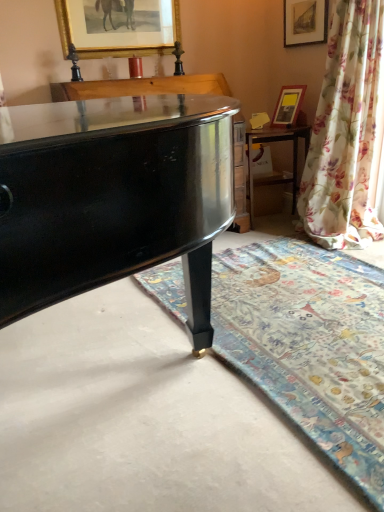
Question: From a real-world perspective, is carpet with floral pattern at lower right below wooden table at right?

Choices:
 (A) yes
 (B) no

Answer: (A)

Question: Would you say carpet with floral pattern at lower right contains wooden table at right?

Choices:
 (A) yes
 (B) no

Answer: (B)

Question: Does carpet with floral pattern at lower right have a larger size compared to wooden table at right?

Choices:
 (A) yes
 (B) no

Answer: (B)

Question: Is carpet with floral pattern at lower right looking in the opposite direction of wooden table at right?

Choices:
 (A) no
 (B) yes

Answer: (A)

Question: Are carpet with floral pattern at lower right and wooden table at right beside each other?

Choices:
 (A) no
 (B) yes

Answer: (A)

Question: Is carpet with floral pattern at lower right positioned far away from wooden table at right?

Choices:
 (A) no
 (B) yes

Answer: (B)

Question: Is carpet with floral pattern at lower right positioned beyond the bounds of gold-framed picture at upper center, which is the first picture frame in left-to-right order?

Choices:
 (A) yes
 (B) no

Answer: (A)

Question: From a real-world perspective, is carpet with floral pattern at lower right positioned over gold-framed picture at upper center, which is the first picture frame in left-to-right order, based on gravity?

Choices:
 (A) no
 (B) yes

Answer: (A)

Question: Is carpet with floral pattern at lower right taller than gold-framed picture at upper center, which appears as the third picture frame when viewed from the right?

Choices:
 (A) no
 (B) yes

Answer: (A)

Question: Is carpet with floral pattern at lower right next to gold-framed picture at upper center, which appears as the third picture frame when viewed from the right?

Choices:
 (A) no
 (B) yes

Answer: (A)

Question: From the image's perspective, does carpet with floral pattern at lower right appear higher than gold-framed picture at upper center, which appears as the third picture frame when viewed from the right?

Choices:
 (A) yes
 (B) no

Answer: (B)

Question: From the image's perspective, would you say carpet with floral pattern at lower right is shown under gold-framed picture at upper center, which is the first picture frame in left-to-right order?

Choices:
 (A) no
 (B) yes

Answer: (B)

Question: Could you tell me if matte gold picture frame at upper right, which ranks as the first picture frame in right-to-left order, is turned towards carpet with floral pattern at lower right?

Choices:
 (A) yes
 (B) no

Answer: (B)